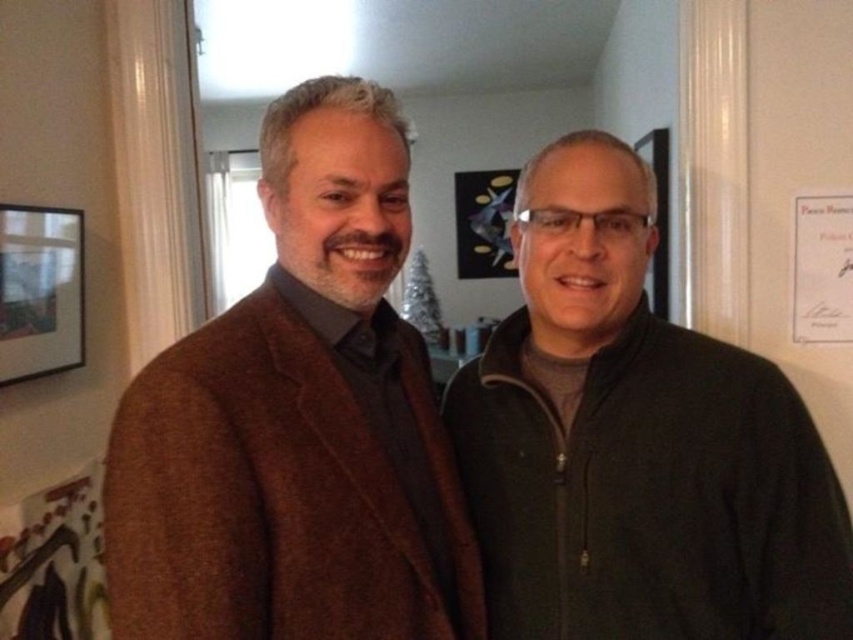
Question: Which of the following is the closest to the observer?

Choices:
 (A) (531, 636)
 (B) (15, 627)
 (C) (45, 225)

Answer: (A)

Question: Is brown woolen jacket at center closer to camera compared to black matte picture frame at upper left?

Choices:
 (A) no
 (B) yes

Answer: (B)

Question: From the image, what is the correct spatial relationship of dark green fleece at center in relation to painted wood bulletin board at lower left?

Choices:
 (A) above
 (B) below

Answer: (A)

Question: Which of the following is the farthest from the observer?

Choices:
 (A) black matte picture frame at upper left
 (B) brown woolen jacket at center
 (C) painted wood bulletin board at lower left
 (D) dark green fleece at center

Answer: (A)

Question: Is dark green fleece at center closer to the viewer compared to painted wood bulletin board at lower left?

Choices:
 (A) yes
 (B) no

Answer: (A)

Question: Estimate the real-world distances between objects in this image. Which object is closer to the black matte picture frame at upper left?

Choices:
 (A) painted wood bulletin board at lower left
 (B) brown woolen jacket at center
 (C) dark green fleece at center

Answer: (A)